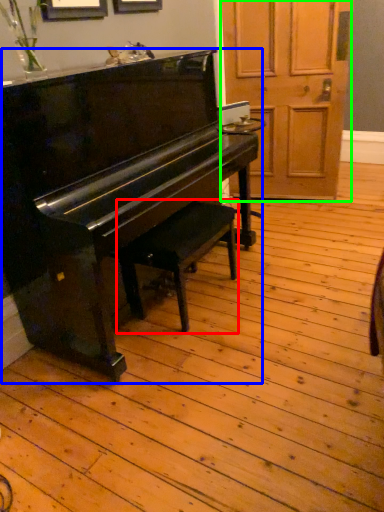
Question: Estimate the real-world distances between objects in this image. Which object is closer to music stool (highlighted by a red box), piano (highlighted by a blue box) or screen door (highlighted by a green box)?

Choices:
 (A) piano
 (B) screen door

Answer: (A)